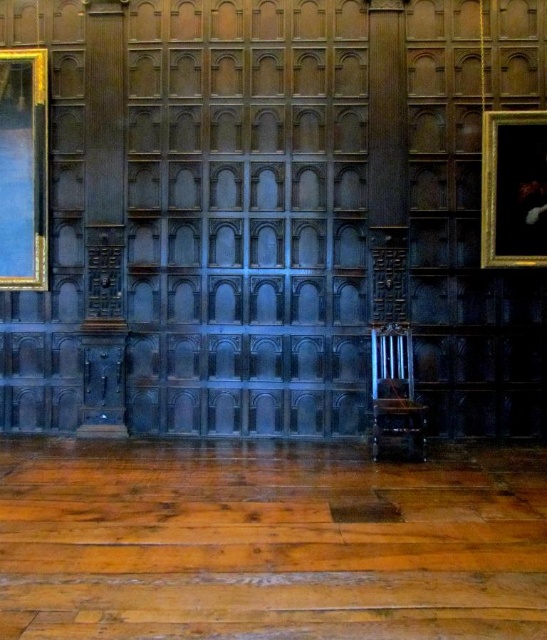
You are arranging a display in this room and need to place a new sculpture between the gold gilded picture frame at left and the polished dark wood chair at center. Can you position it directly in the middle between them?

Yes, since the gold gilded picture frame at left is to the left of the polished dark wood chair at center, there is space to place the sculpture directly in the middle between them.